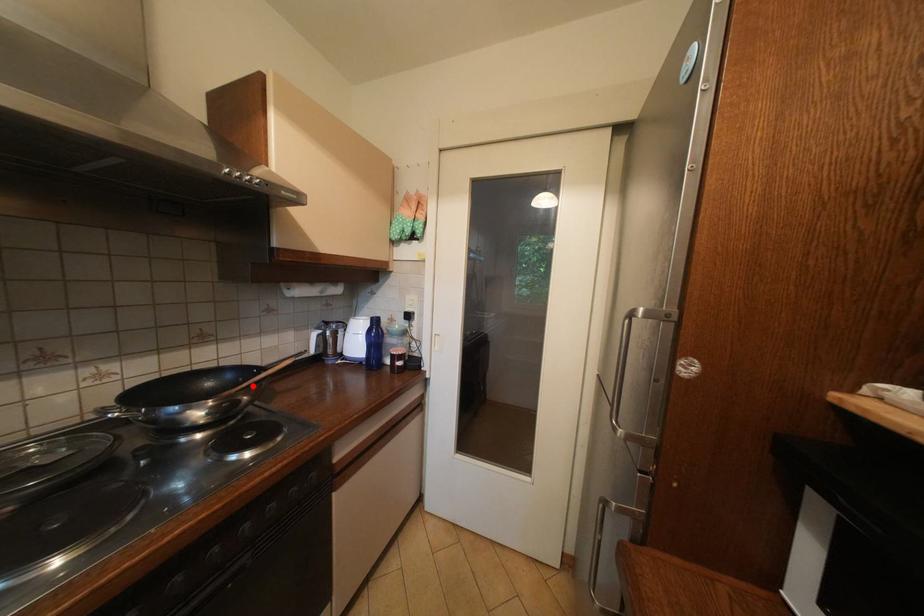
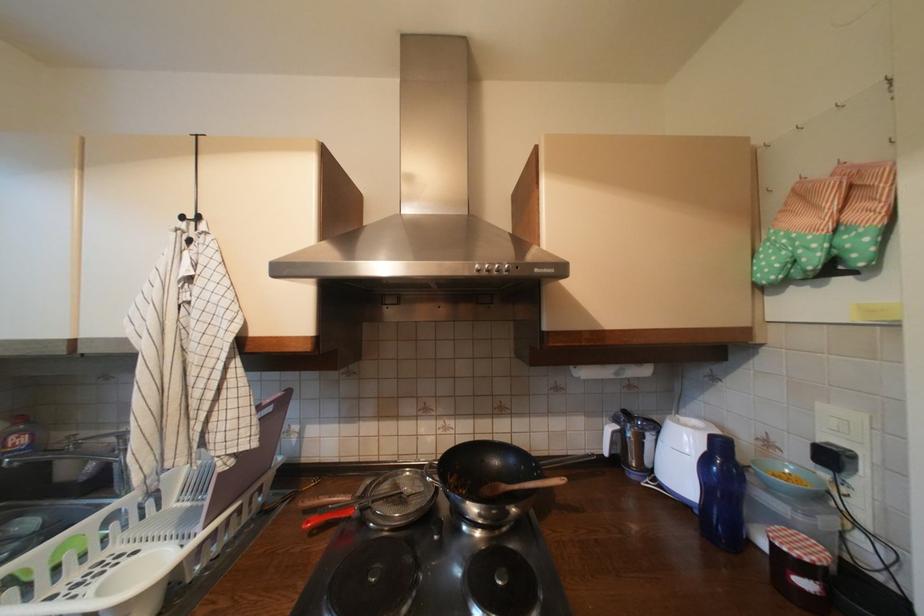
In the second image, find the point that corresponds to the highlighted location in the first image.

(525, 488)